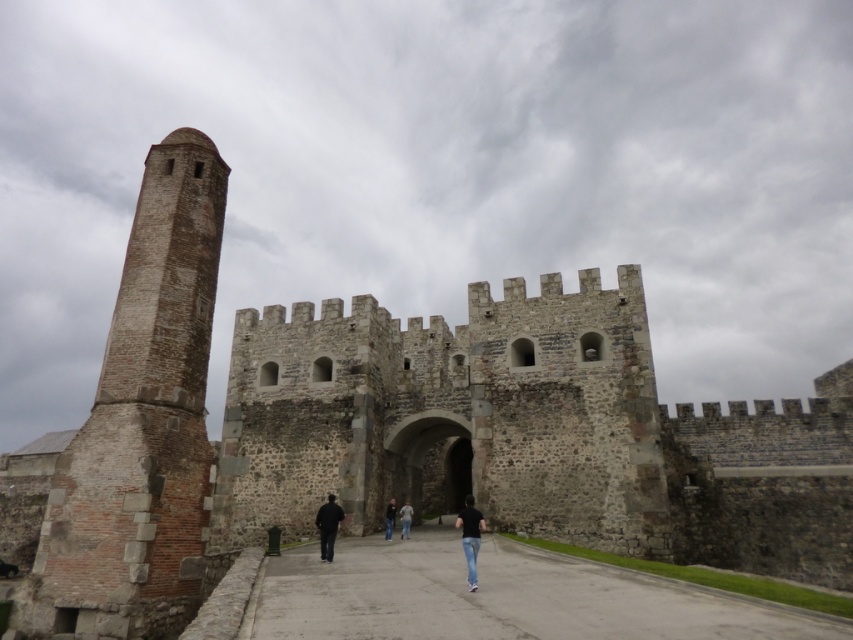
You are a visitor approaching the castle entrance. You notice the brown stone tower at left and the dark gray jeans at center. Which object appears wider from your perspective?

The brown stone tower at left appears wider than the dark gray jeans at center because its width is larger.